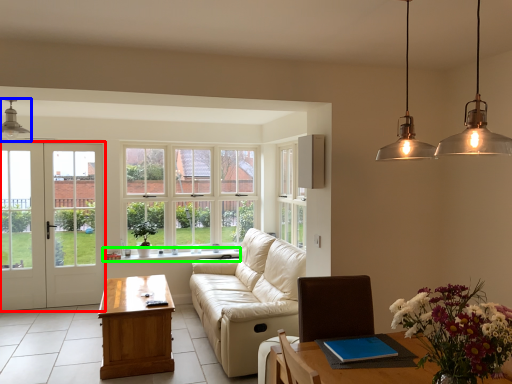
Question: Considering the real-world distances, which object is farthest from door (highlighted by a red box)? light fixture (highlighted by a blue box) or window sill (highlighted by a green box)?

Choices:
 (A) light fixture
 (B) window sill

Answer: (A)